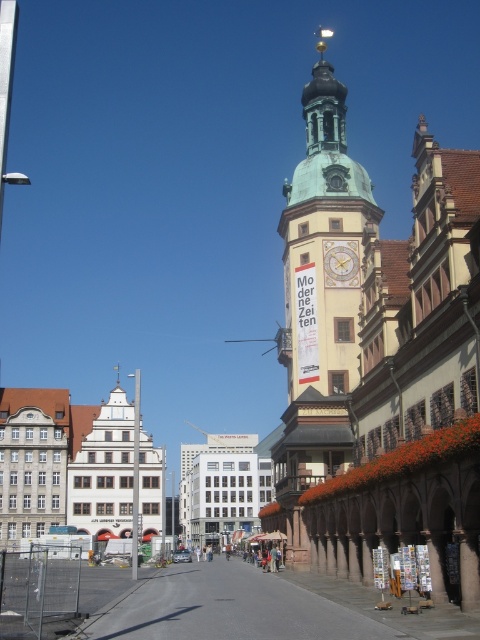
Based on the photo, you are a tourist standing in front of the historic building with a prominent clock tower. You notice both the yellowish stone clock tower at center and the gold metallic clock at center. Which object is located higher up in the image?

The yellowish stone clock tower at center is positioned over the gold metallic clock at center, so the yellowish stone clock tower at center is higher up in the image.

You are standing at the entrance of the historic building and want to locate the yellowish stone clock tower at center. According to the coordinates provided, where should you look relative to your current position?

The yellowish stone clock tower at center is located at coordinates point 0.380 on the x axis and 0.671 on the y axis, so you should look towards the center of the image to find it.

From the picture: You are a tourist standing in front of the historic building. You notice the yellowish stone clock tower at center and the gold metallic clock at center. Which object is positioned to the right of the other?

The yellowish stone clock tower at center is to the right of the gold metallic clock at center.